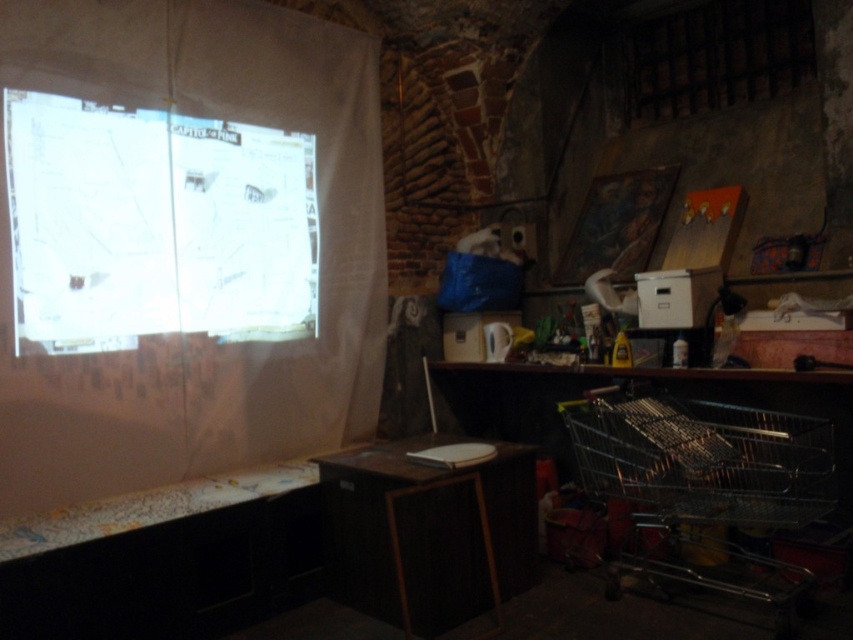
Question: Which object is farther from the camera taking this photo?

Choices:
 (A) white fabric curtain at left
 (B) wooden table at center
 (C) metallic wire shopping cart at lower right

Answer: (A)

Question: Does white fabric curtain at left have a smaller size compared to white paper at upper left?

Choices:
 (A) no
 (B) yes

Answer: (A)

Question: Estimate the real-world distances between objects in this image. Which object is closer to the white fabric curtain at left?

Choices:
 (A) metallic wire shopping cart at lower right
 (B) wooden table at center
 (C) white paper at upper left

Answer: (C)

Question: Where is metallic wire shopping cart at lower right located in relation to wooden table at center in the image?

Choices:
 (A) above
 (B) below

Answer: (A)

Question: Estimate the real-world distances between objects in this image. Which object is farther from the wooden table at center?

Choices:
 (A) metallic wire shopping cart at lower right
 (B) white paper at upper left
 (C) white fabric curtain at left

Answer: (B)

Question: Is white fabric curtain at left bigger than wooden table at center?

Choices:
 (A) yes
 (B) no

Answer: (A)